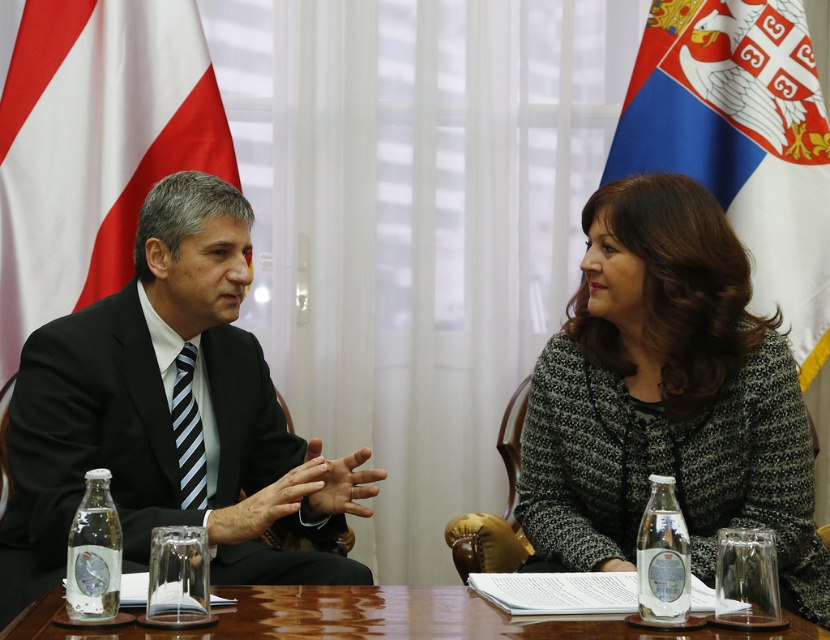
Between black suit at center and white fabric flag at left, which one is positioned lower?

Positioned lower is black suit at center.

Which is more to the right, black suit at center or white fabric flag at left?

black suit at center is more to the right.

Is point (204, 292) positioned before point (105, 104)?

Yes, it is.

This screenshot has height=640, width=830. I want to click on black suit at center, so click(169, 413).

Between point (155, 388) and point (658, 16), which one is positioned behind?

The point (658, 16) is more distant.

Does black suit at center lie in front of white fabric flag at right?

That is True.

Find the location of `black suit at center`. black suit at center is located at coordinates (169, 413).

This screenshot has width=830, height=640. In order to click on speckled woolen sweater at center in this screenshot , I will do `click(667, 397)`.

Does speckled woolen sweater at center have a lesser width compared to black suit at center?

Yes.

Image resolution: width=830 pixels, height=640 pixels. What do you see at coordinates (667, 397) in the screenshot?
I see `speckled woolen sweater at center` at bounding box center [667, 397].

This screenshot has height=640, width=830. Identify the location of speckled woolen sweater at center. (667, 397).